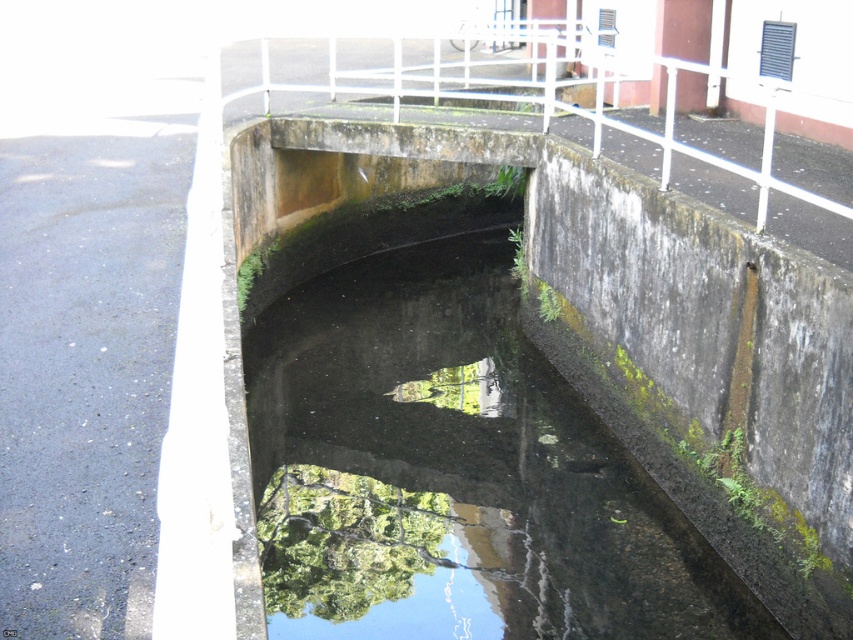
You are a maintenance worker inspecting the culvert structure. You notice the green mossy concrete puddle at center and the white metal rail at upper center. Which object is positioned higher from the ground?

The white metal rail at upper center is positioned higher from the ground than the green mossy concrete puddle at center.

You are standing at the edge of the culvert and want to place two markers at the coordinates point (350, 342) and point (635, 128). Which marker will be closer to your current position?

Point (350, 342) is further to the viewer than point (635, 128), so the marker at point (635, 128) will be closer to your current position.

You are standing at the camera position and want to reach the point at coordinates (457, 307) in the image. The culvert is 1.5 meters deep. Can you step into the culvert to reach that point?

The point at coordinates (457, 307) is 12.89 meters away from the camera. Since the culvert is only 1.5 meters deep, you would need to traverse the entire length of the culvert to reach the point, but the distance is too great. Therefore, stepping into the culvert won